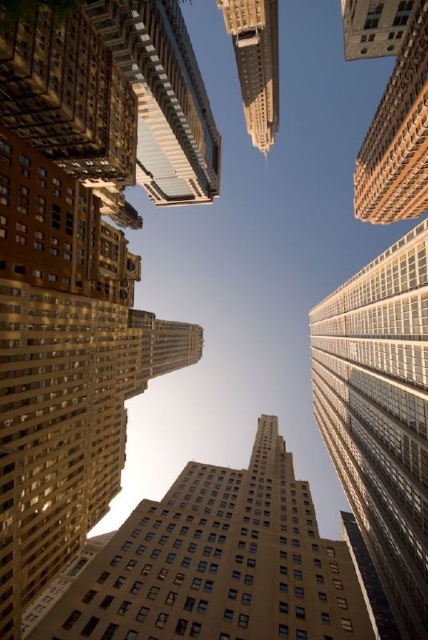
How much distance is there between gold textured building at upper left and gold textured building at upper center?

gold textured building at upper left is 38.03 meters from gold textured building at upper center.

Does point (133, 42) come farther from viewer compared to point (246, 108)?

No, it is not.

What are the coordinates of `gold textured building at upper left` in the screenshot? It's located at pyautogui.click(x=163, y=99).

How far apart are glassy reflective skyscraper at center and gold textured building at upper left?

glassy reflective skyscraper at center is 81.97 meters from gold textured building at upper left.

Is point (397, 593) closer to camera compared to point (124, 42)?

No, (397, 593) is behind (124, 42).

Identify the location of glassy reflective skyscraper at center. (380, 413).

Can you confirm if glassy reflective skyscraper at center is smaller than gold textured building at upper center?

Incorrect, glassy reflective skyscraper at center is not smaller in size than gold textured building at upper center.

Who is positioned more to the left, glassy reflective skyscraper at center or gold textured building at upper center?

gold textured building at upper center is more to the left.

Image resolution: width=428 pixels, height=640 pixels. What do you see at coordinates (380, 413) in the screenshot?
I see `glassy reflective skyscraper at center` at bounding box center [380, 413].

Locate an element on the screen. This screenshot has width=428, height=640. glassy reflective skyscraper at center is located at coordinates (380, 413).